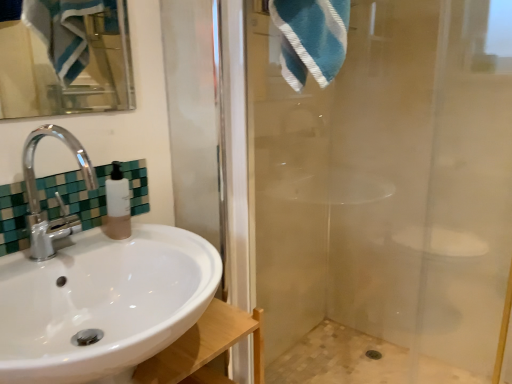
Question: From the image's perspective, is transparent glass shower door at right over beige mosaic tile bath at lower right?

Choices:
 (A) no
 (B) yes

Answer: (B)

Question: Is transparent glass shower door at right to the right of beige mosaic tile bath at lower right from the viewer's perspective?

Choices:
 (A) no
 (B) yes

Answer: (A)

Question: Is transparent glass shower door at right completely or partially outside of beige mosaic tile bath at lower right?

Choices:
 (A) yes
 (B) no

Answer: (A)

Question: From the image's perspective, is transparent glass shower door at right under beige mosaic tile bath at lower right?

Choices:
 (A) yes
 (B) no

Answer: (B)

Question: Is transparent glass shower door at right facing away from beige mosaic tile bath at lower right?

Choices:
 (A) yes
 (B) no

Answer: (A)

Question: Does transparent glass shower door at right have a larger size compared to beige mosaic tile bath at lower right?

Choices:
 (A) no
 (B) yes

Answer: (B)

Question: Is green mosaic tile at upper left further to camera compared to beige mosaic tile bath at lower right?

Choices:
 (A) no
 (B) yes

Answer: (A)

Question: Considering the relative sizes of green mosaic tile at upper left and beige mosaic tile bath at lower right in the image provided, is green mosaic tile at upper left smaller than beige mosaic tile bath at lower right?

Choices:
 (A) yes
 (B) no

Answer: (A)

Question: Can you confirm if green mosaic tile at upper left is wider than beige mosaic tile bath at lower right?

Choices:
 (A) yes
 (B) no

Answer: (B)

Question: Can you confirm if green mosaic tile at upper left is bigger than beige mosaic tile bath at lower right?

Choices:
 (A) no
 (B) yes

Answer: (A)

Question: From the image's perspective, would you say green mosaic tile at upper left is positioned over beige mosaic tile bath at lower right?

Choices:
 (A) yes
 (B) no

Answer: (A)

Question: Is green mosaic tile at upper left located outside beige mosaic tile bath at lower right?

Choices:
 (A) no
 (B) yes

Answer: (B)

Question: Is beige mosaic tile bath at lower right aimed at transparent glass shower door at right?

Choices:
 (A) no
 (B) yes

Answer: (A)